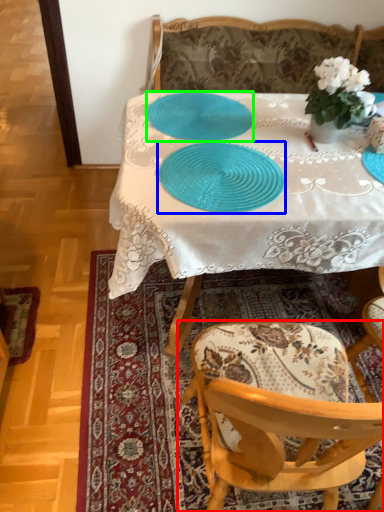
Question: Which object is the closest to the chair (highlighted by a red box)? Choose among these: tableware (highlighted by a blue box) or tableware (highlighted by a green box).

Choices:
 (A) tableware
 (B) tableware

Answer: (A)